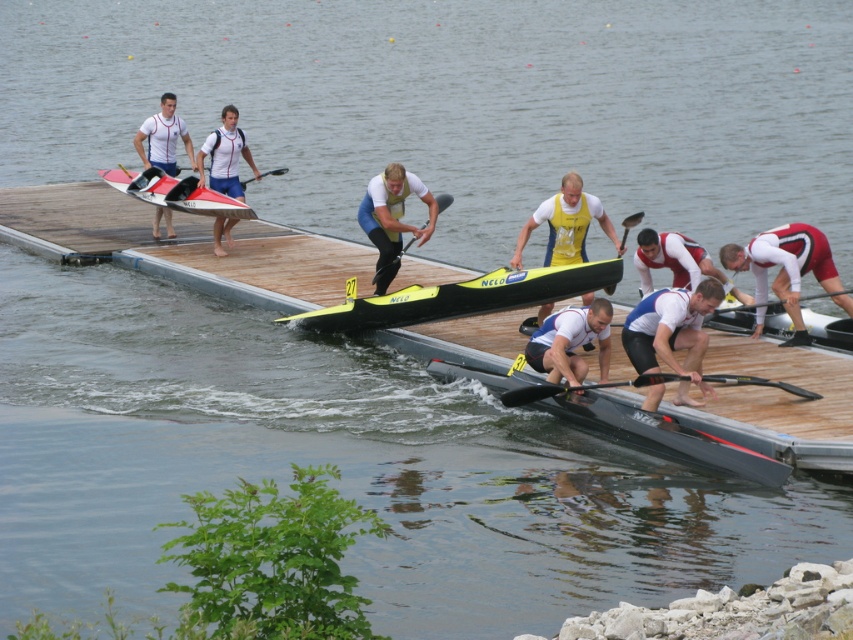
Question: Estimate the real-world distances between objects in this image. Which object is closer to the red fabric rower at center?

Choices:
 (A) matte white and blue rower at center
 (B) yellow matte kayak at center
 (C) yellow fabric rower at center
 (D) black plastic paddle at center

Answer: (D)

Question: Can you confirm if white matte kayak at center is wider than yellow fabric rower at center?

Choices:
 (A) yes
 (B) no

Answer: (B)

Question: Which point is farther from the camera taking this photo?

Choices:
 (A) (270, 173)
 (B) (572, 177)

Answer: (A)

Question: Can you confirm if red fabric rower at center is positioned to the right of white fabric shirt at center?

Choices:
 (A) no
 (B) yes

Answer: (B)

Question: Among these objects, which one is nearest to the camera?

Choices:
 (A) black rubber paddle at center
 (B) black plastic paddle at center
 (C) white matte rower at center
 (D) yellow fabric rower at center

Answer: (C)

Question: In this image, where is white matte kayak at center located relative to black plastic paddle at center?

Choices:
 (A) right
 (B) left

Answer: (B)